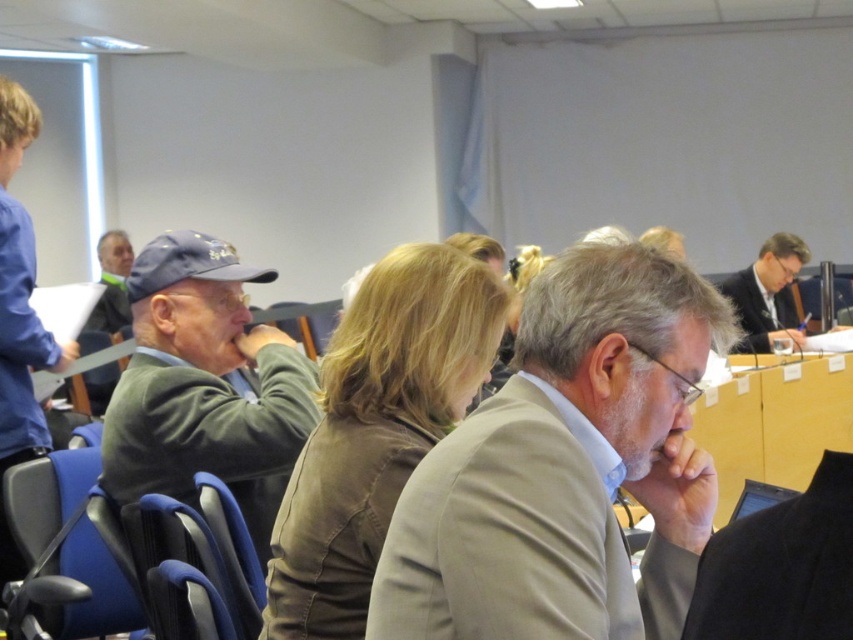
Can you confirm if light beige suit at center is positioned above matte gray cap at upper left?

No.

Is light beige suit at center to the left of matte gray cap at upper left from the viewer's perspective?

No, light beige suit at center is not to the left of matte gray cap at upper left.

Between point (509, 396) and point (107, 253), which one is positioned behind?

Positioned behind is point (107, 253).

Locate an element on the screen. Image resolution: width=853 pixels, height=640 pixels. light beige suit at center is located at coordinates (566, 468).

Between green wool sweater at left and dark suit at right, which one appears on the left side from the viewer's perspective?

Positioned to the left is green wool sweater at left.

Can you confirm if green wool sweater at left is wider than dark suit at right?

No, green wool sweater at left is not wider than dark suit at right.

Is point (252, 444) positioned in front of point (770, 257)?

Yes, it is in front of point (770, 257).

What are the coordinates of `green wool sweater at left` in the screenshot? It's located at coord(206,385).

This screenshot has width=853, height=640. Describe the element at coordinates (767, 292) in the screenshot. I see `dark suit at right` at that location.

Can you confirm if dark suit at right is shorter than matte gray cap at upper left?

Correct, dark suit at right is not as tall as matte gray cap at upper left.

This screenshot has width=853, height=640. What do you see at coordinates (767, 292) in the screenshot?
I see `dark suit at right` at bounding box center [767, 292].

The width and height of the screenshot is (853, 640). What are the coordinates of `dark suit at right` in the screenshot? It's located at (767, 292).